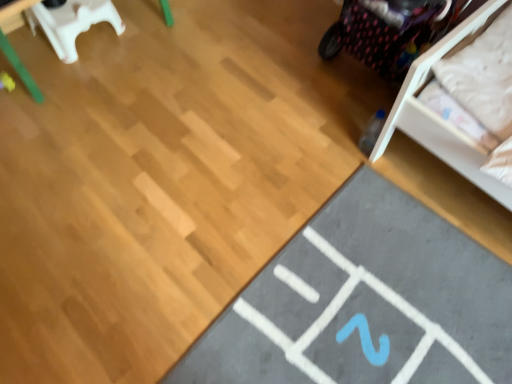
Question: From a real-world perspective, is white plastic chair at upper left physically located above or below gray rubber yoga mat at lower right?

Choices:
 (A) below
 (B) above

Answer: (B)

Question: Considering their positions, is white plastic chair at upper left located in front of or behind gray rubber yoga mat at lower right?

Choices:
 (A) behind
 (B) front

Answer: (A)

Question: In the image, is white plastic chair at upper left on the left side or the right side of gray rubber yoga mat at lower right?

Choices:
 (A) right
 (B) left

Answer: (B)

Question: In terms of height, does gray rubber yoga mat at lower right look taller or shorter compared to white plastic chair at upper left?

Choices:
 (A) tall
 (B) short

Answer: (B)

Question: Is gray rubber yoga mat at lower right bigger or smaller than white plastic chair at upper left?

Choices:
 (A) small
 (B) big

Answer: (B)

Question: Is gray rubber yoga mat at lower right wider or thinner than white plastic chair at upper left?

Choices:
 (A) wide
 (B) thin

Answer: (A)

Question: From a real-world perspective, relative to white plastic chair at upper left, is gray rubber yoga mat at lower right vertically above or below?

Choices:
 (A) above
 (B) below

Answer: (B)